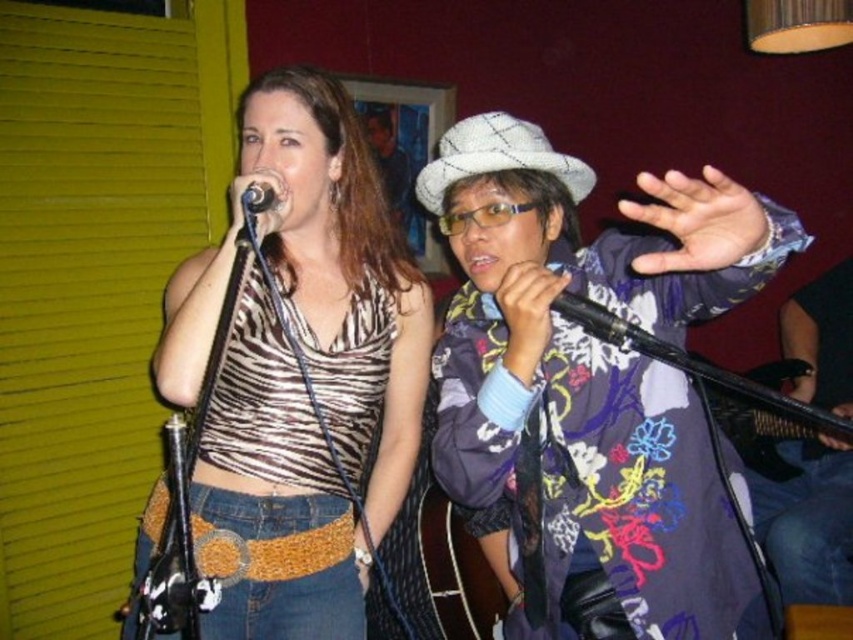
Which is above, zebra print tank top at center or floral fabric instrument at center?

floral fabric instrument at center is above.

Is zebra print tank top at center smaller than floral fabric instrument at center?

No, zebra print tank top at center is not smaller than floral fabric instrument at center.

Looking at this image, who is more forward, (354, 401) or (614, 321)?

Point (614, 321)

You are a GUI agent. You are given a task and a screenshot of the screen. Output one action in this format:
    pyautogui.click(x=<x>, y=<y>)
    Task: Click on the zebra print tank top at center
    
    Given the screenshot: What is the action you would take?
    pyautogui.click(x=299, y=372)

Is floral-patterned fabric at center to the left of floral fabric instrument at center from the viewer's perspective?

Indeed, floral-patterned fabric at center is positioned on the left side of floral fabric instrument at center.

Between floral-patterned fabric at center and floral fabric instrument at center, which one appears on the left side from the viewer's perspective?

floral-patterned fabric at center is more to the left.

Is point (645, 595) positioned behind point (579, 304)?

Yes, point (645, 595) is behind point (579, 304).

Locate an element on the screen. The width and height of the screenshot is (853, 640). floral-patterned fabric at center is located at coordinates (595, 371).

Can you confirm if zebra print tank top at center is positioned below black matte microphone at upper center?

Yes.

Which is in front, point (410, 436) or point (270, 200)?

Point (270, 200) is in front.

This screenshot has height=640, width=853. What are the coordinates of `zebra print tank top at center` in the screenshot? It's located at (299, 372).